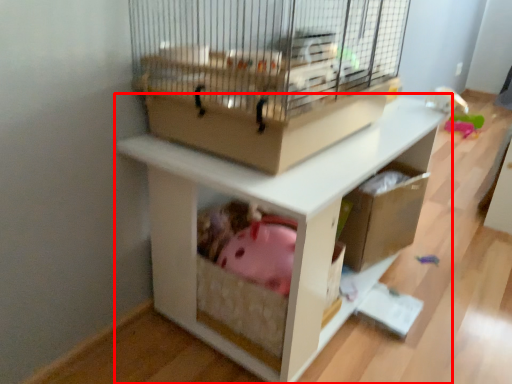
Question: From the image's perspective, what is the correct spatial positioning of shelf (annotated by the red box) in reference to bird cage?

Choices:
 (A) above
 (B) below

Answer: (B)